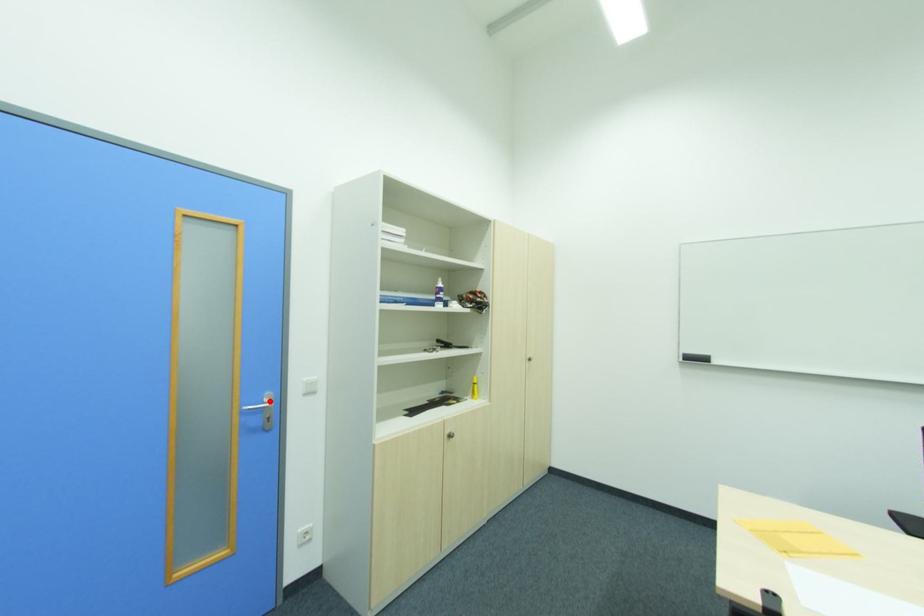
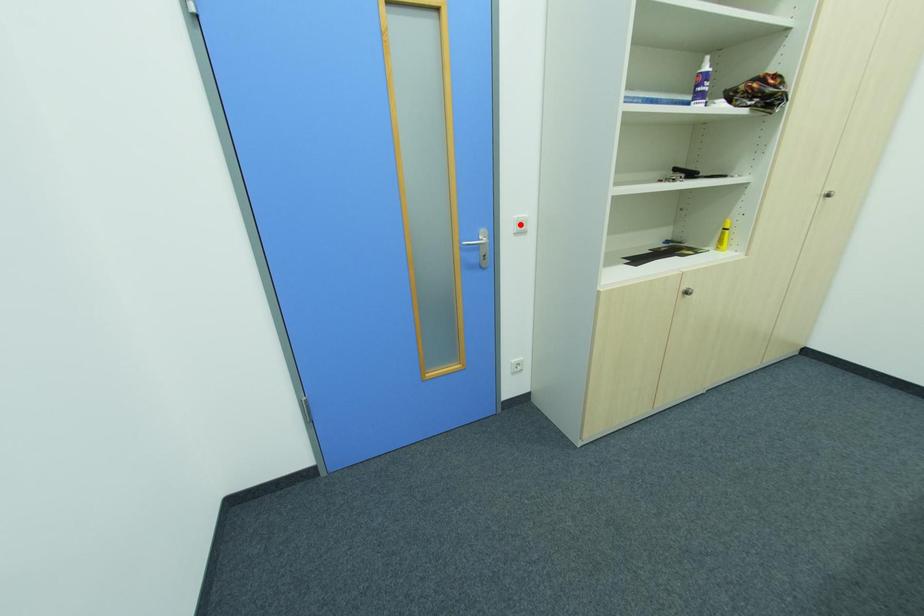
I am providing you with two images of the same scene from different viewpoints. A red point is marked on the first image and another point is marked on the second image. Are the points marked in image1 and image2 representing the same 3D position?

No